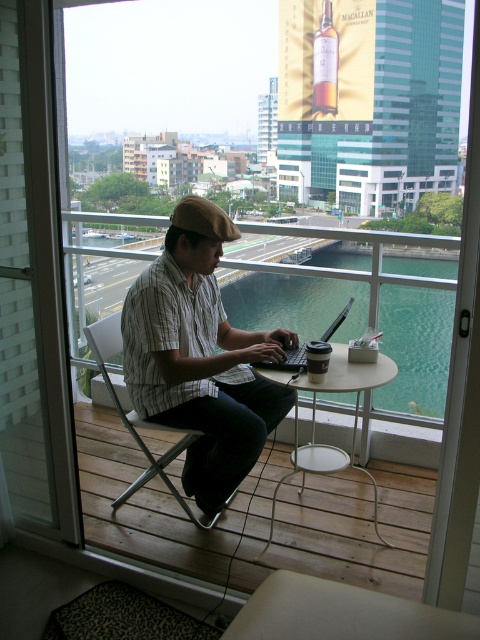
Who is taller, white metal table at center or metallic silver chair at center?

metallic silver chair at center is taller.

Does point (338, 392) lie behind point (181, 442)?

No, it is in front of (181, 442).

Is point (302, 378) positioned after point (165, 465)?

No, (302, 378) is in front of (165, 465).

Where is `white metal table at center`? white metal table at center is located at coordinates (314, 419).

Describe the element at coordinates (340, 612) in the screenshot. I see `leopard print rug at lower left` at that location.

Which of these two, leopard print rug at lower left or metallic silver chair at center, stands taller?

metallic silver chair at center is taller.

In order to click on leopard print rug at lower left in this screenshot , I will do `click(340, 612)`.

Where is `striped cotton shirt at center`? This screenshot has width=480, height=640. striped cotton shirt at center is located at coordinates (200, 356).

Is striped cotton shirt at center positioned behind leopard print rug at lower left?

That is True.

Locate an element on the screen. striped cotton shirt at center is located at coordinates (200, 356).